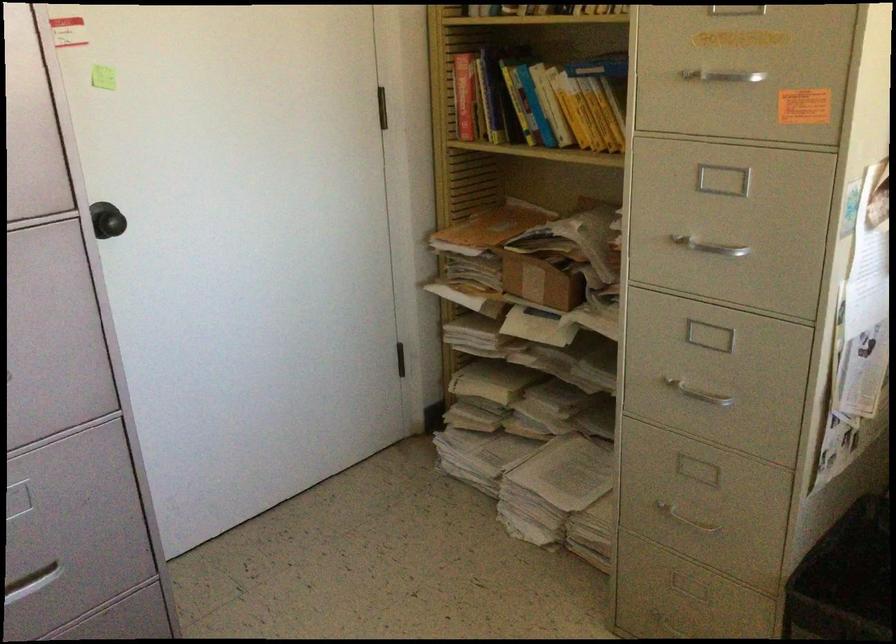
Locate an element on the screen. black doorknob is located at coordinates (115, 223).